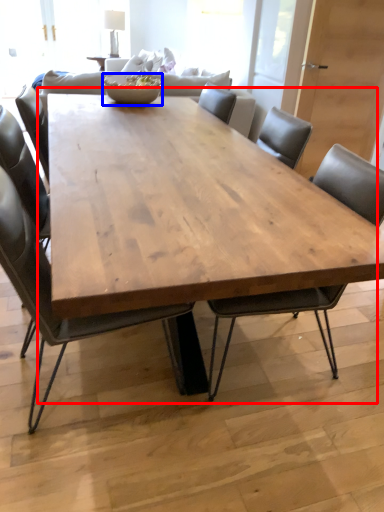
Question: Which point is closer to the camera, coffee table (highlighted by a red box) or bowl (highlighted by a blue box)?

Choices:
 (A) coffee table
 (B) bowl

Answer: (A)